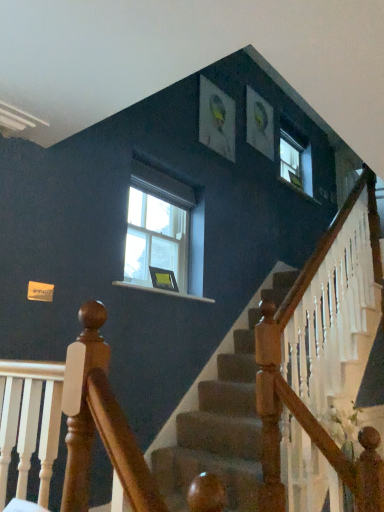
Question: Are matte black picture frame at center and clear glass window at center located far from each other?

Choices:
 (A) yes
 (B) no

Answer: (B)

Question: Does matte black picture frame at center come behind clear glass window at center?

Choices:
 (A) yes
 (B) no

Answer: (A)

Question: From a real-world perspective, is matte black picture frame at center beneath clear glass window at center?

Choices:
 (A) no
 (B) yes

Answer: (B)

Question: Is matte black picture frame at center bigger than clear glass window at center?

Choices:
 (A) yes
 (B) no

Answer: (B)

Question: Is matte black picture frame at center positioned beyond the bounds of clear glass window at center?

Choices:
 (A) no
 (B) yes

Answer: (B)

Question: Could you tell me if matte black picture frame at center is turned towards clear glass window at center?

Choices:
 (A) no
 (B) yes

Answer: (A)

Question: From the image's perspective, is clear glass window at center over matte black picture frame at center?

Choices:
 (A) no
 (B) yes

Answer: (B)

Question: Considering the relative positions of clear glass window at center and matte black picture frame at center in the image provided, is clear glass window at center in front of matte black picture frame at center?

Choices:
 (A) yes
 (B) no

Answer: (A)

Question: Is clear glass window at center located outside matte black picture frame at center?

Choices:
 (A) yes
 (B) no

Answer: (A)

Question: Does clear glass window at center come behind matte black picture frame at center?

Choices:
 (A) yes
 (B) no

Answer: (B)

Question: Does clear glass window at center appear on the right side of matte black picture frame at center?

Choices:
 (A) no
 (B) yes

Answer: (A)

Question: Is matte black picture frame at center at the back of clear glass window at center?

Choices:
 (A) yes
 (B) no

Answer: (B)

Question: Considering the positions of matte black picture frame at center and clear glass window at center in the image, is matte black picture frame at center taller or shorter than clear glass window at center?

Choices:
 (A) short
 (B) tall

Answer: (A)